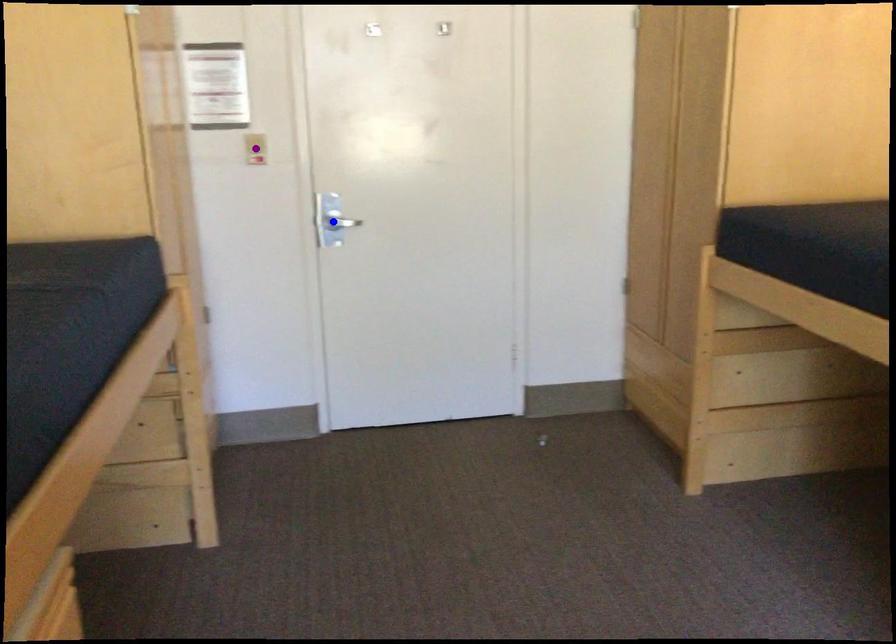
In the scene shown: Order these from nearest to farthest:
blue point | red point | purple point

red point → purple point → blue point